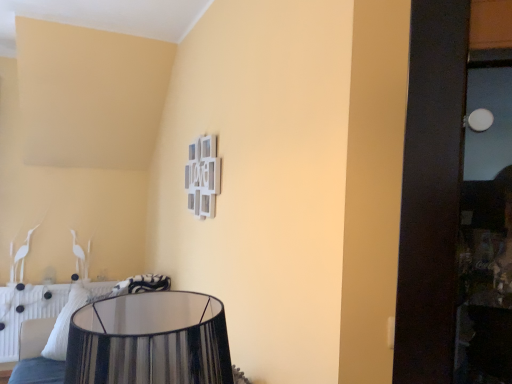
What do you see at coordinates (67, 332) in the screenshot? The width and height of the screenshot is (512, 384). I see `white textured bed at lower left` at bounding box center [67, 332].

Image resolution: width=512 pixels, height=384 pixels. What are the coordinates of `white textured bed at lower left` in the screenshot? It's located at (67, 332).

In order to click on white textured bed at lower left in this screenshot , I will do `click(67, 332)`.